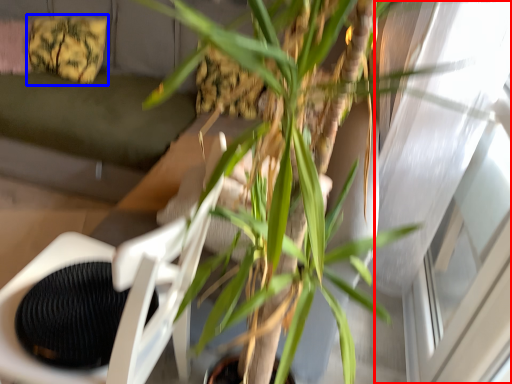
Question: Which object appears closest to the camera in this image, window (highlighted by a red box) or pillow (highlighted by a blue box)?

Choices:
 (A) window
 (B) pillow

Answer: (A)